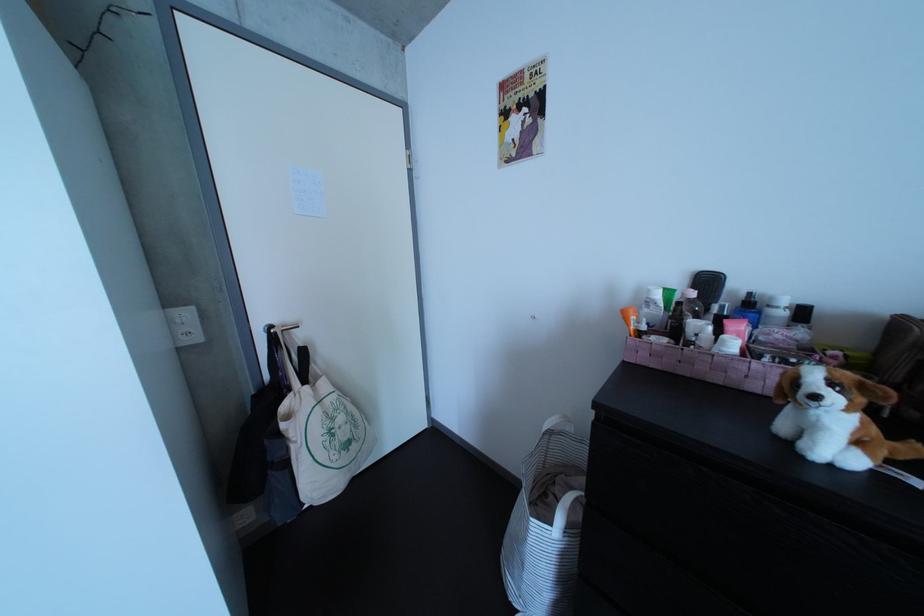
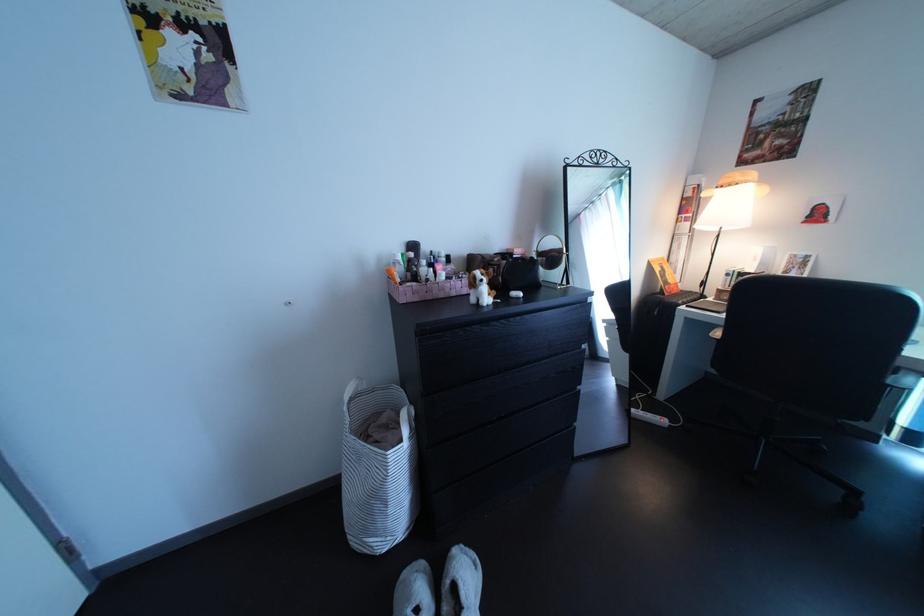
Where in the second image is the point corresponding to (x=764, y=362) from the first image?

(464, 286)